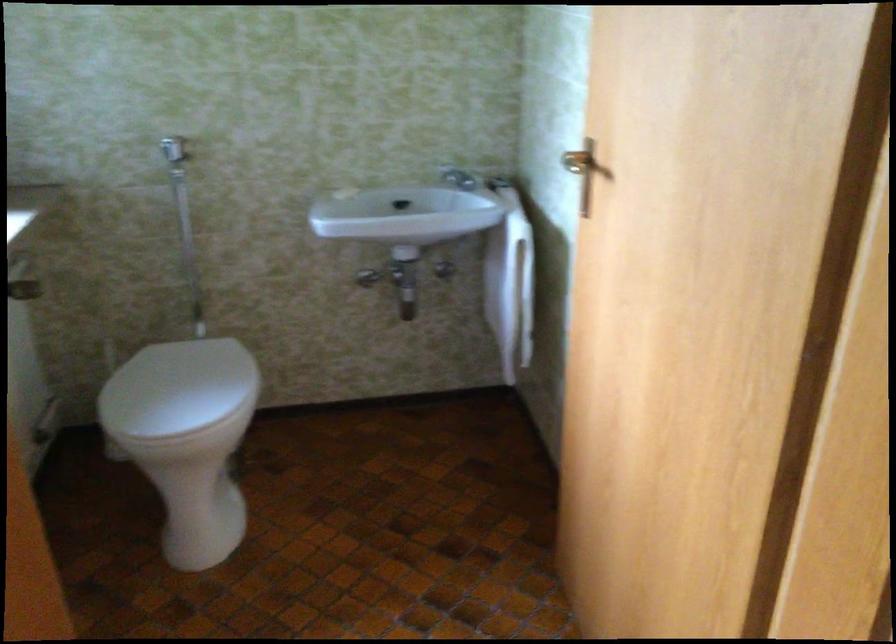
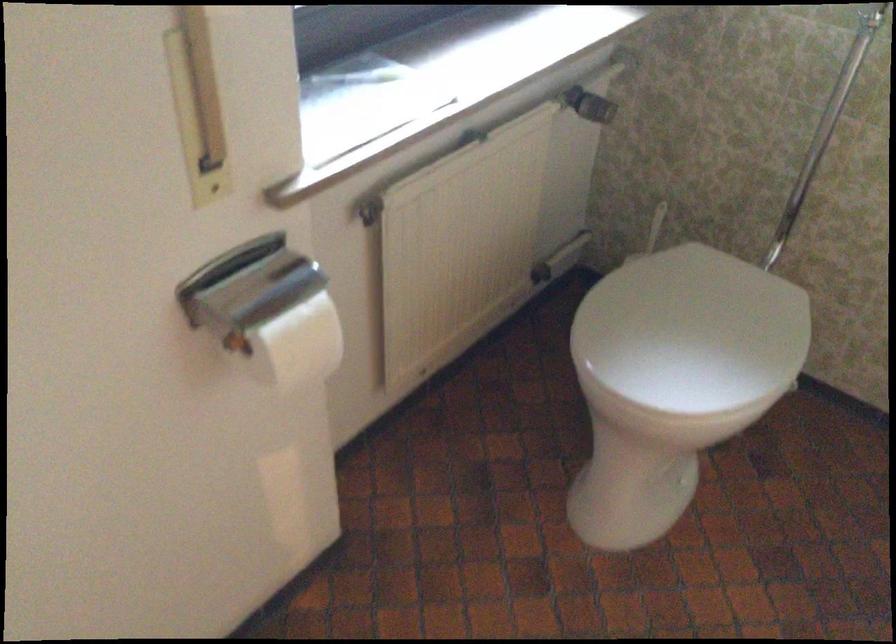
In the scene shown: The images are taken continuously from a first-person perspective. In which direction is your viewpoint rotating?

The rotation direction of the camera is left-down.